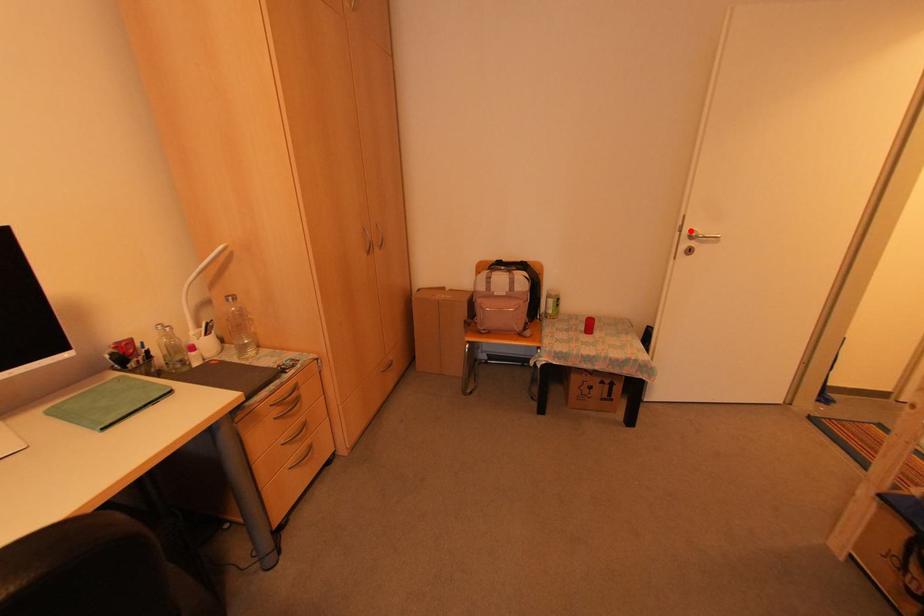
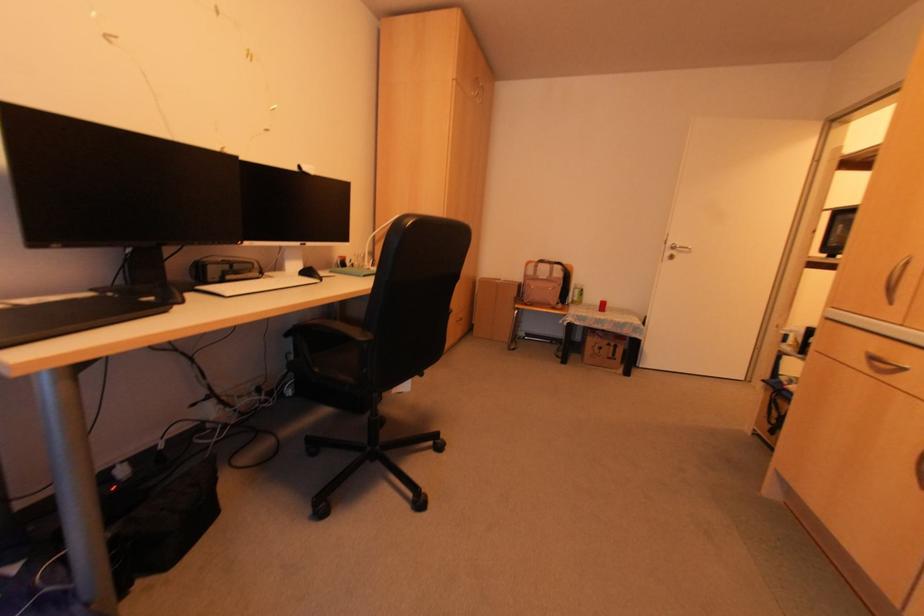
Find the pixel in the second image that matches the highlighted location in the first image.

(671, 245)